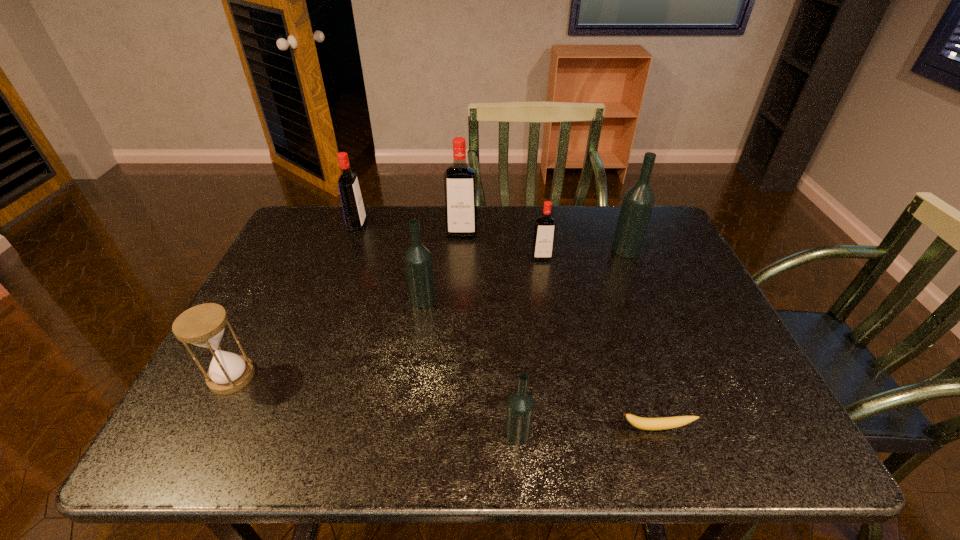
The image size is (960, 540). Identify the location of free location that satisfies the following two spatial constraints: 1. on the front side of the fifth farthest vodka; 2. on the left side of the fourth vodka from left to right. (404, 434).

In order to click on free location that satisfies the following two spatial constraints: 1. on the back side of the white hourglass; 2. on the right side of the rightmost black vodka in this screenshot , I will do `click(297, 250)`.

The height and width of the screenshot is (540, 960). What are the coordinates of `free space that satisfies the following two spatial constraints: 1. on the front and back of the second red vodka from left to right; 2. on the right side of the nearest vodka` in the screenshot? It's located at (451, 434).